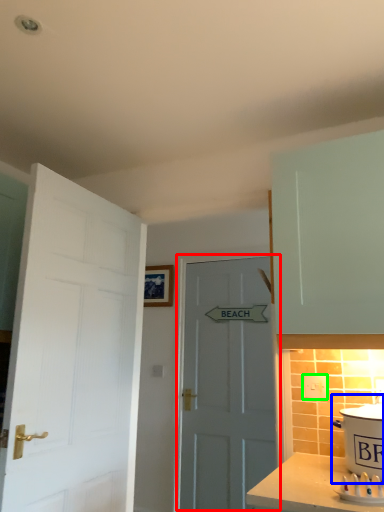
Question: Considering the real-world distances, which object is closest to door (highlighted by a red box)? cooker (highlighted by a blue box) or electric outlet (highlighted by a green box).

Choices:
 (A) cooker
 (B) electric outlet

Answer: (B)